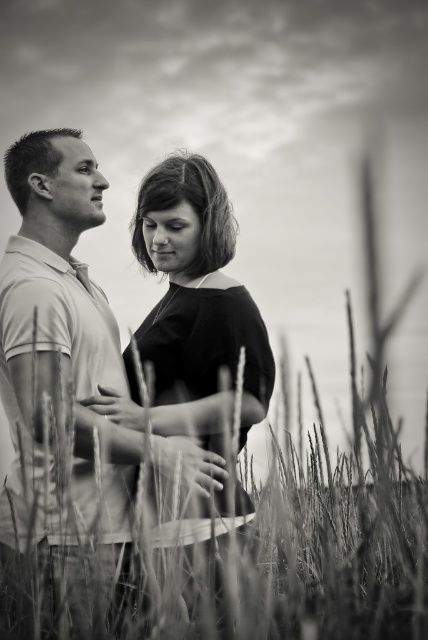
Identify the location of smooth black dress at center. The height and width of the screenshot is (640, 428). (119, 388).

Looking at this image, does smooth black dress at center appear over fuzzy grass at center?

Yes.

Is point (80, 220) closer to camera compared to point (305, 636)?

No, (80, 220) is further to viewer.

Locate an element on the screen. smooth black dress at center is located at coordinates (119, 388).